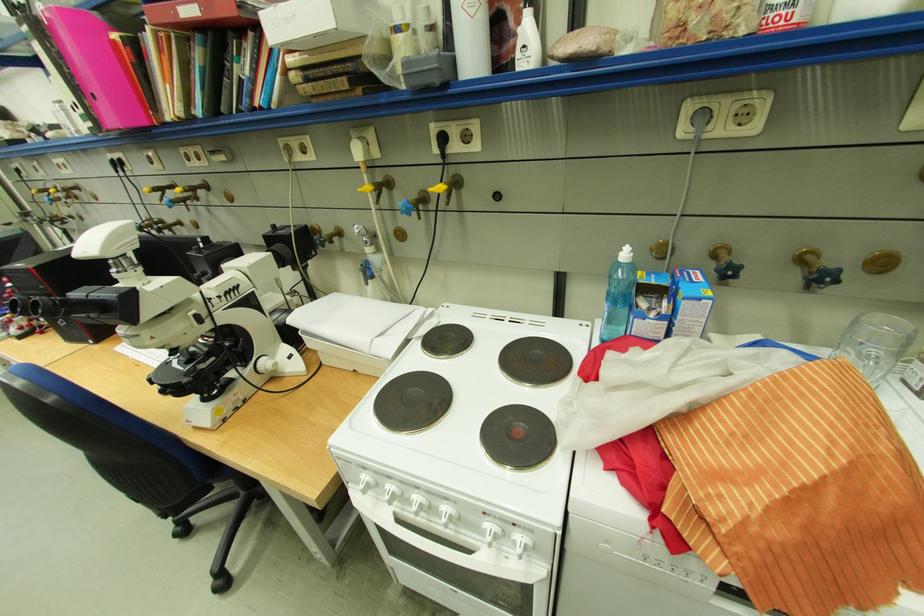
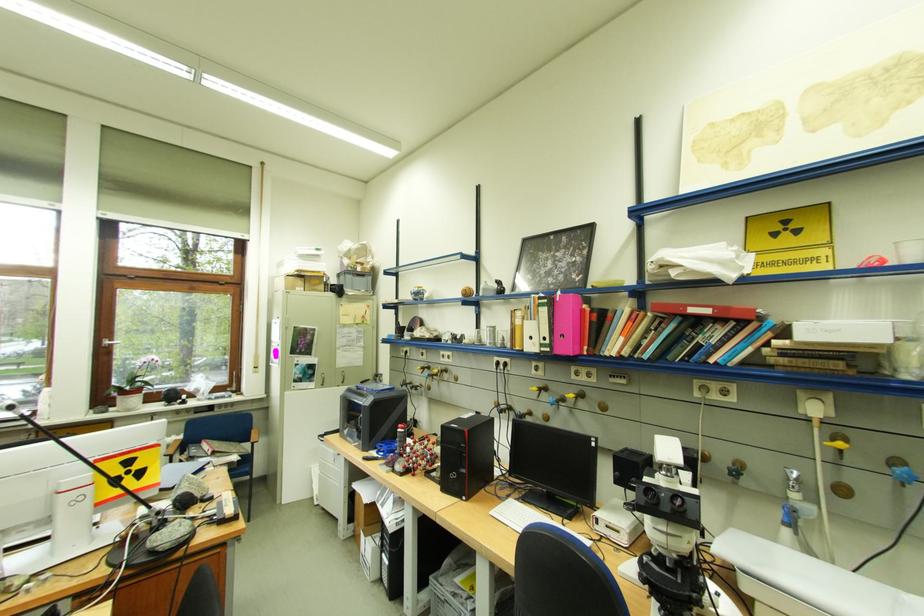
Find the pixel in the second image that matches the point at 189,382 in the first image.

(698, 594)